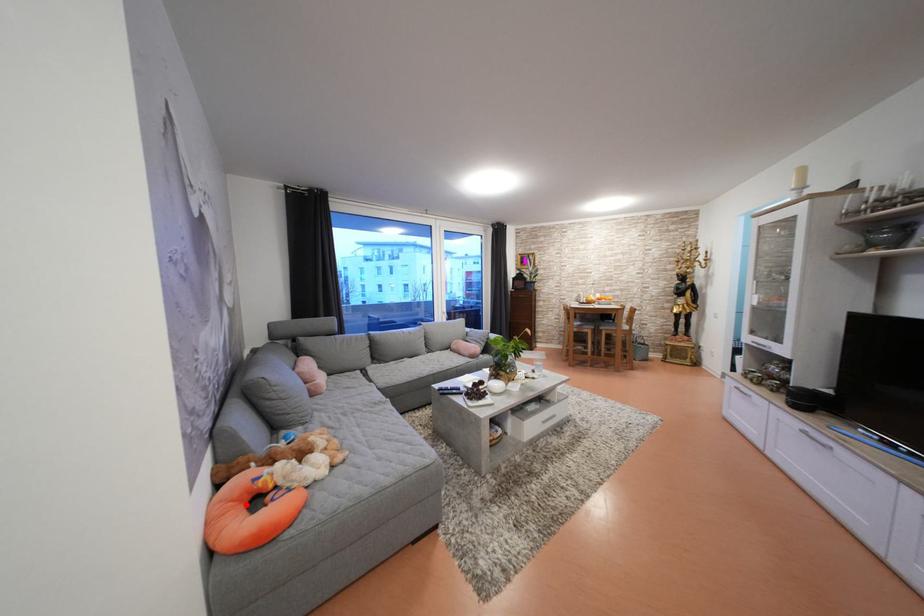
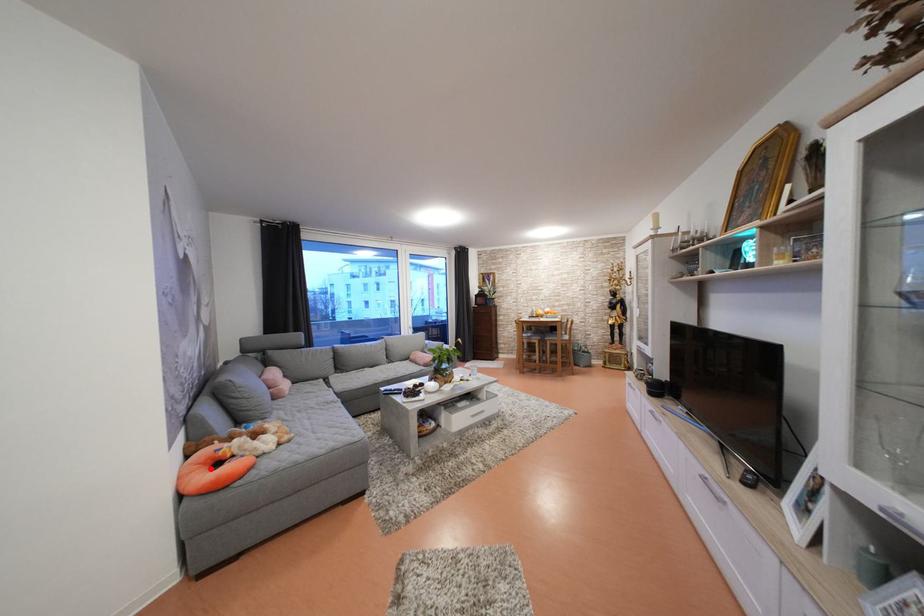
I am providing you with two images of the same scene from different viewpoints. A red point is marked on the first image and another point is marked on the second image. Do the highlighted points in image1 and image2 indicate the same real-world spot?

Yes